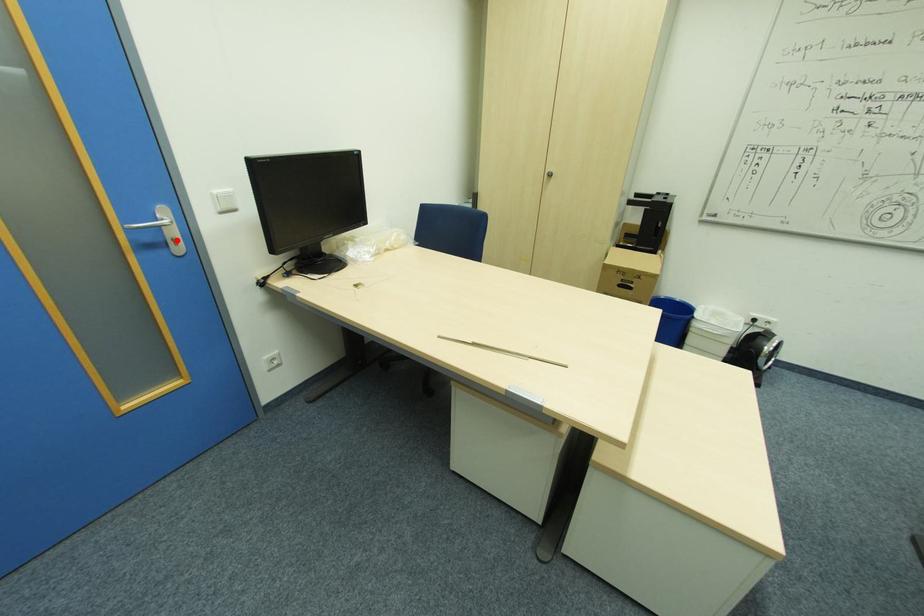
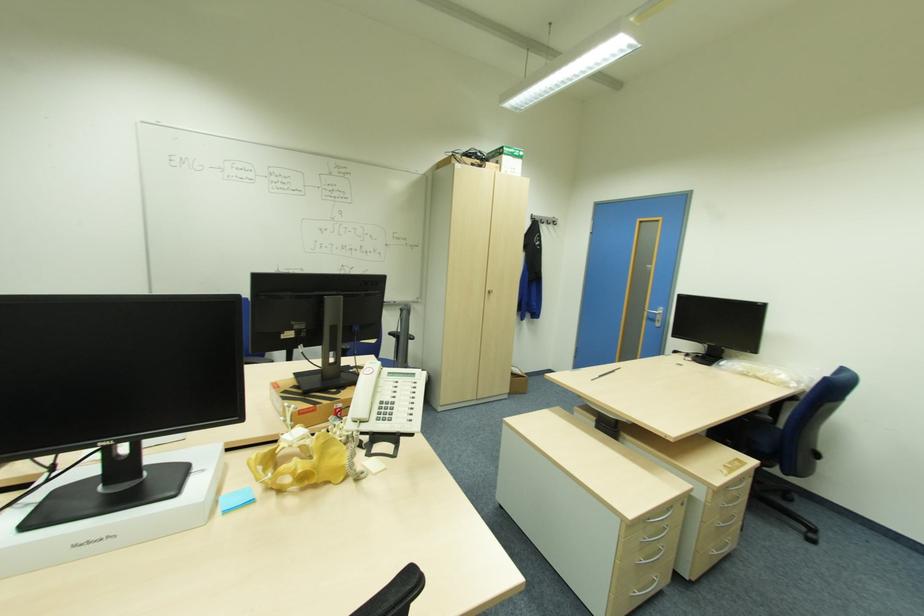
In the second image, find the point that corresponds to the highlighted location in the first image.

(661, 321)